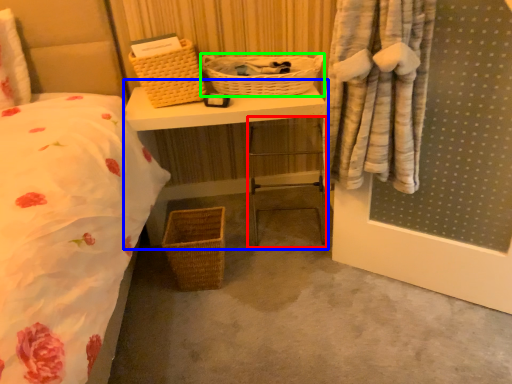
Question: Based on their relative distances, which object is farther from chair (highlighted by a red box)? Choose from vanity (highlighted by a blue box) and picnic basket (highlighted by a green box).

Choices:
 (A) vanity
 (B) picnic basket

Answer: (A)